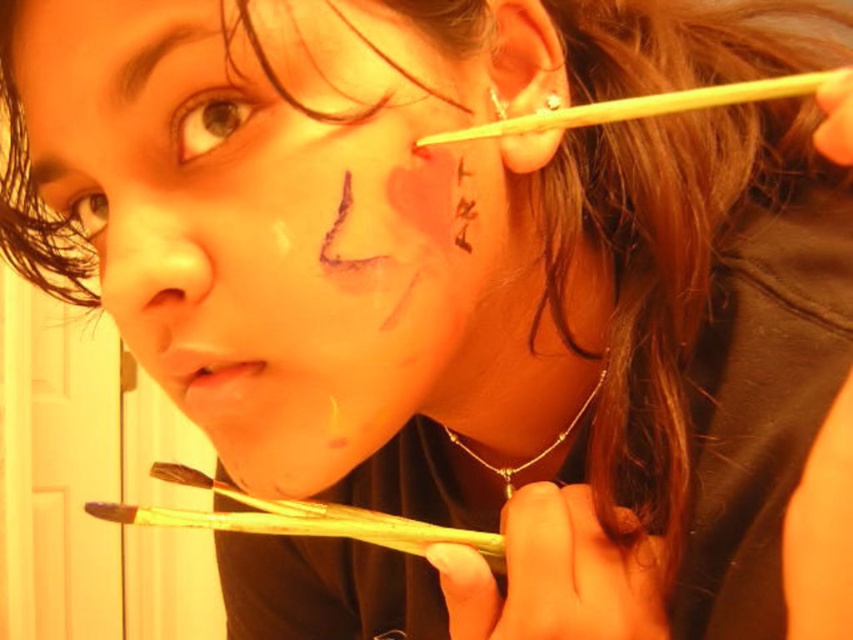
You are a makeup artist preparing for a client who wants a bold look. You have a matte black paint at center and dark brown hair at upper left. Which object would you use to create a larger design on their face?

The matte black paint at center has a larger size compared to the dark brown hair at upper left, so you should use the matte black paint at center to create a larger design on their face.

You are an artist trying to paint a line from point (262, 196) to point (57, 156) on the person face. Since the points are at different distances from you, will the line appear longer or shorter than it actually is?

The line between point (262, 196) and point (57, 156) will appear shorter than it actually is because point (262, 196) is closer to the viewer than point (57, 156), creating a perspective effect that shortens the perceived length.